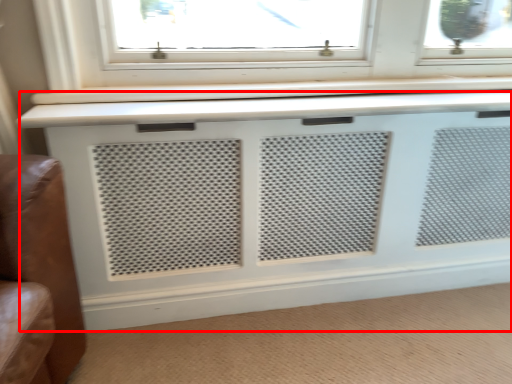
Question: In this image, where is air conditioning (annotated by the red box) located relative to plain?

Choices:
 (A) right
 (B) left

Answer: (A)